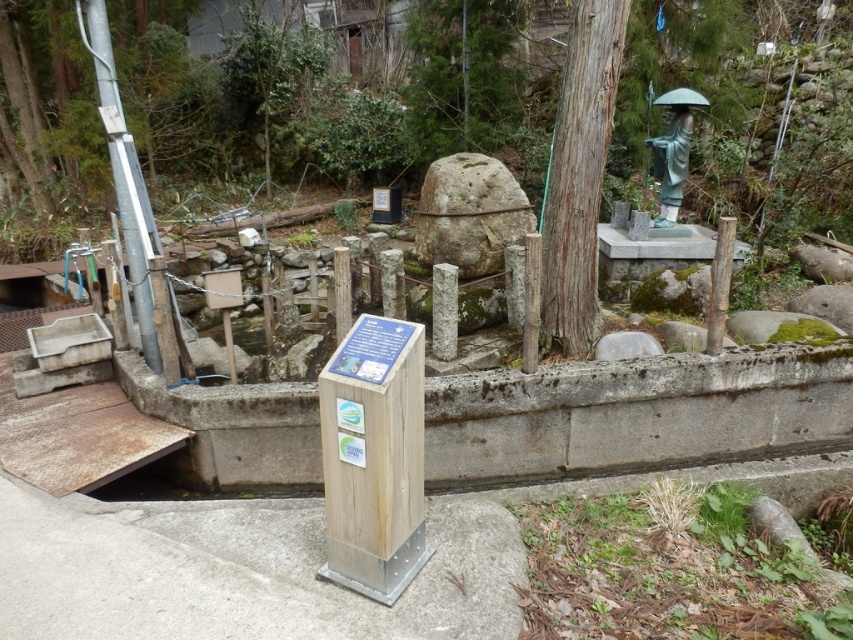
Question: Does smooth gray stone at center appear under gray smooth rock at center?

Choices:
 (A) yes
 (B) no

Answer: (B)

Question: Based on their relative distances, which object is farther from the green patina statue at upper right?

Choices:
 (A) gray smooth rock at center
 (B) smooth gray stone at center
 (C) green mossy rock at upper center
 (D) brown rough textured tree at upper right

Answer: (C)

Question: Does brown rough textured tree at upper right appear on the left side of green patina statue at upper right?

Choices:
 (A) yes
 (B) no

Answer: (A)

Question: Which point appears closest to the camera in this image?

Choices:
 (A) (688, 150)
 (B) (509, 122)
 (C) (596, 182)

Answer: (C)

Question: Where is brown rough textured tree at upper right located in relation to green patina statue at upper right in the image?

Choices:
 (A) above
 (B) below

Answer: (B)

Question: Which point is farther to the camera?

Choices:
 (A) green mossy rock at upper center
 (B) gray smooth rock at center
 (C) smooth gray stone at center
 (D) green patina statue at upper right

Answer: (A)